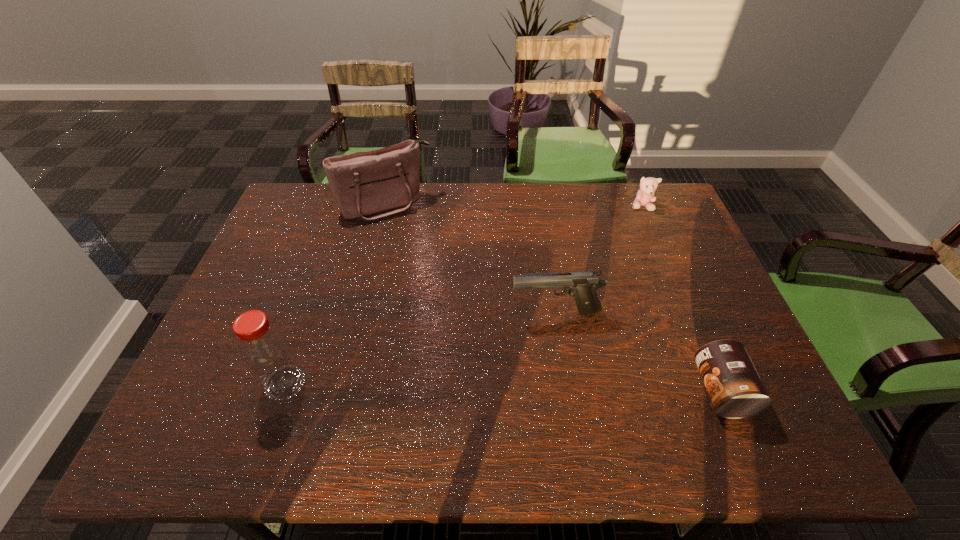
Locate an element on the screen. The image size is (960, 540). free point between the teddy bear and the bottle is located at coordinates (464, 295).

Identify the location of vacant space in between the shoulder bag and the can. pyautogui.click(x=554, y=298).

The image size is (960, 540). In order to click on empty space that is in between the third farthest object and the bottle in this screenshot , I will do `click(420, 348)`.

The width and height of the screenshot is (960, 540). I want to click on free space that is in between the bottle and the third object from right to left, so click(x=420, y=348).

The height and width of the screenshot is (540, 960). What are the coordinates of `empty space between the can and the teddy bear` in the screenshot? It's located at (682, 299).

This screenshot has width=960, height=540. I want to click on object that is the third closest to the bottle, so click(735, 388).

Select which object is the fourth closest to the third tallest object. Please provide its 2D coordinates. Your answer should be formatted as a tuple, i.e. [(x, y)], where the tuple contains the x and y coordinates of a point satisfying the conditions above.

[(266, 352)]

Find the location of a particular element. Image resolution: width=960 pixels, height=540 pixels. free space that satisfies the following two spatial constraints: 1. on the front side of the can; 2. on the front label of the bottle is located at coordinates (282, 390).

Identify the location of blank area in the image that satisfies the following two spatial constraints: 1. on the back side of the bottle; 2. on the right side of the third farthest object. (309, 313).

Image resolution: width=960 pixels, height=540 pixels. I want to click on free space that satisfies the following two spatial constraints: 1. on the back side of the third shortest object; 2. on the right side of the bottle, so click(x=309, y=313).